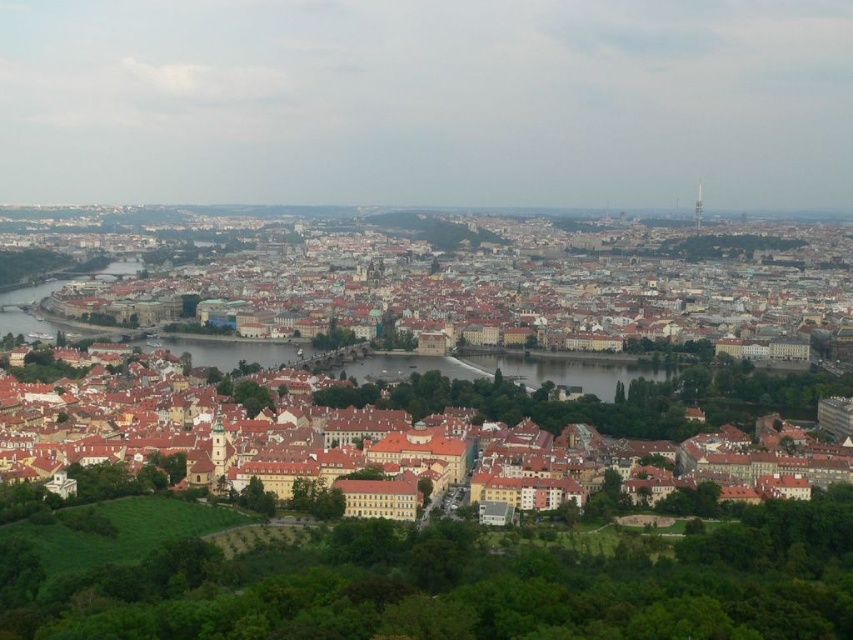
Question: Where is brown tiled roofs at center located in relation to brown textured buildings at center in the image?

Choices:
 (A) left
 (B) right

Answer: (B)

Question: Which of the following is the closest to the observer?

Choices:
 (A) (222, 323)
 (B) (697, 424)

Answer: (B)

Question: Does brown tiled roofs at center have a smaller size compared to brown textured buildings at center?

Choices:
 (A) yes
 (B) no

Answer: (B)

Question: Is brown tiled roofs at center wider than brown textured buildings at center?

Choices:
 (A) yes
 (B) no

Answer: (A)

Question: Which of the following is the closest to the observer?

Choices:
 (A) brown tiled roofs at center
 (B) brown textured buildings at center

Answer: (B)